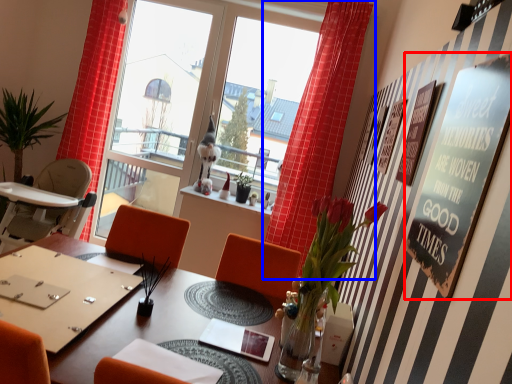
Question: Among these objects, which one is farthest to the camera, bulletin board (highlighted by a red box) or curtain (highlighted by a blue box)?

Choices:
 (A) bulletin board
 (B) curtain

Answer: (B)